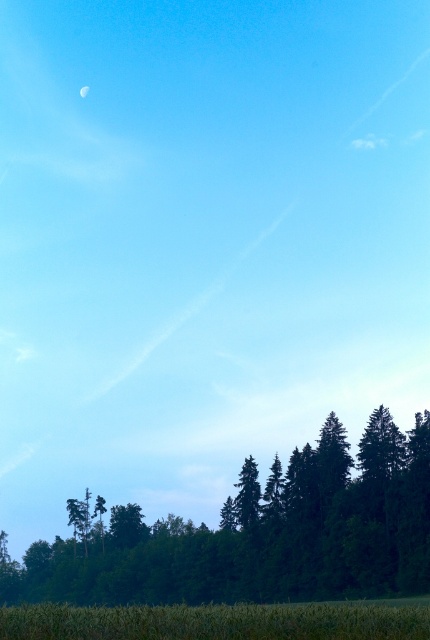
Question: Which point is closer to the camera?

Choices:
 (A) green matte tree at lower center
 (B) green grass at bottom

Answer: (B)

Question: Does green matte tree at lower center appear on the left side of green grass at bottom?

Choices:
 (A) yes
 (B) no

Answer: (A)

Question: Which of the following is the farthest from the observer?

Choices:
 (A) green grass at bottom
 (B) green matte tree at lower center

Answer: (B)

Question: Observing the image, what is the correct spatial positioning of green matte tree at lower center in reference to green grass at bottom?

Choices:
 (A) right
 (B) left

Answer: (B)

Question: Is green matte tree at lower center smaller than green grass at bottom?

Choices:
 (A) yes
 (B) no

Answer: (B)